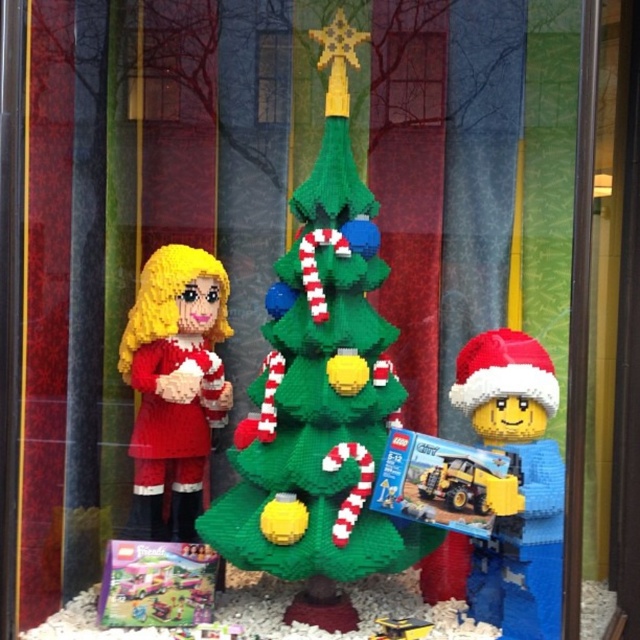
Is transparent glass at center shorter than yellow plastic toy truck at center?

No, transparent glass at center is not shorter than yellow plastic toy truck at center.

Does transparent glass at center appear on the left side of yellow plastic toy truck at center?

Yes, transparent glass at center is to the left of yellow plastic toy truck at center.

Is point (264, 83) positioned behind point (408, 620)?

Yes, point (264, 83) is farther from viewer.

This screenshot has width=640, height=640. What are the coordinates of `transparent glass at center` in the screenshot? It's located at (273, 76).

Who is taller, transparent glass window at center or yellow plastic toy truck at center?

With more height is transparent glass window at center.

The height and width of the screenshot is (640, 640). Find the location of `transparent glass window at center`. transparent glass window at center is located at coordinates (413, 77).

This screenshot has height=640, width=640. What are the coordinates of `transparent glass window at center` in the screenshot? It's located at (413, 77).

The height and width of the screenshot is (640, 640). I want to click on transparent glass window at center, so click(413, 77).

Is translucent plastic toy at center positioned behind transparent glass at center?

No, it is in front of transparent glass at center.

Locate an element on the screen. translucent plastic toy at center is located at coordinates (156, 584).